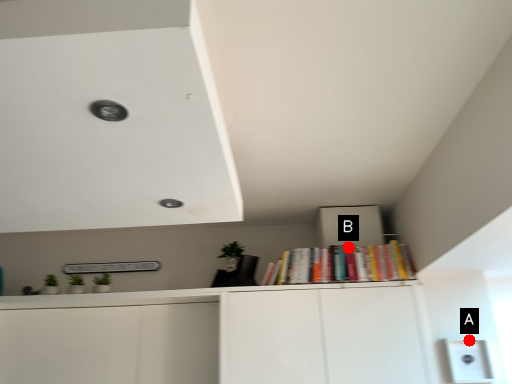
Question: Two points are circled on the image, labeled by A and B beside each circle. Which point appears farthest from the camera in this image?

Choices:
 (A) A is further
 (B) B is further

Answer: (B)